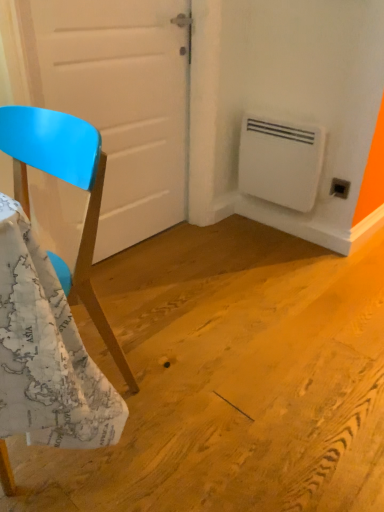
Where is `matte blue chair at left`? The height and width of the screenshot is (512, 384). matte blue chair at left is located at coordinates (69, 183).

The image size is (384, 512). I want to click on black plastic electric outlet at lower right, so click(x=339, y=188).

Image resolution: width=384 pixels, height=512 pixels. Describe the element at coordinates (280, 161) in the screenshot. I see `white plastic air conditioning unit at lower right` at that location.

What are the coordinates of `matte blue chair at left` in the screenshot? It's located at (69, 183).

Could you tell me if white plastic air conditioning unit at lower right is turned towards white matte door at center?

Yes, white plastic air conditioning unit at lower right is facing white matte door at center.

From the image's perspective, is white plastic air conditioning unit at lower right located above white matte door at center?

No, from the image's perspective, white plastic air conditioning unit at lower right is not on top of white matte door at center.

From a real-world perspective, is white plastic air conditioning unit at lower right located beneath white matte door at center?

Yes, from a real-world perspective, white plastic air conditioning unit at lower right is under white matte door at center.

Can you see white plastic air conditioning unit at lower right touching white matte door at center?

white plastic air conditioning unit at lower right is not next to white matte door at center, and they're not touching.

Is point (94, 296) positioned in front of point (335, 183)?

Yes.

From a real-world perspective, is matte blue chair at left positioned under black plastic electric outlet at lower right based on gravity?

Actually, matte blue chair at left is physically above black plastic electric outlet at lower right in the real world.

Could black plastic electric outlet at lower right be considered to be inside matte blue chair at left?

No, black plastic electric outlet at lower right is not a part of matte blue chair at left.

Considering the positions of objects white matte door at center and black plastic electric outlet at lower right in the image provided, who is more to the left, white matte door at center or black plastic electric outlet at lower right?

From the viewer's perspective, white matte door at center appears more on the left side.

Considering the positions of objects white matte door at center and black plastic electric outlet at lower right in the image provided, who is behind, white matte door at center or black plastic electric outlet at lower right?

black plastic electric outlet at lower right is behind.

Based on their sizes in the image, would you say white matte door at center is bigger or smaller than black plastic electric outlet at lower right?

Clearly, white matte door at center is larger in size than black plastic electric outlet at lower right.

From a real-world perspective, is white matte door at center positioned above or below black plastic electric outlet at lower right?

Clearly, from a real-world perspective, white matte door at center is above black plastic electric outlet at lower right.

From the image's perspective, does matte blue chair at left appear lower than white matte door at center?

Yes, from the image's perspective, matte blue chair at left is below white matte door at center.

Consider the image. How many degrees apart are the facing directions of matte blue chair at left and white matte door at center?

89.6 degrees separate the facing orientations of matte blue chair at left and white matte door at center.

Is matte blue chair at left oriented towards white matte door at center?

No, matte blue chair at left is not turned towards white matte door at center.

Considering the sizes of matte blue chair at left and white matte door at center in the image, is matte blue chair at left wider or thinner than white matte door at center?

In the image, matte blue chair at left appears to be wider than white matte door at center.

Could you tell me if white plastic air conditioning unit at lower right is facing black plastic electric outlet at lower right?

No, white plastic air conditioning unit at lower right is not aimed at black plastic electric outlet at lower right.

From the image's perspective, which one is positioned higher, white plastic air conditioning unit at lower right or black plastic electric outlet at lower right?

white plastic air conditioning unit at lower right is shown above in the image.

From a real-world perspective, which object rests below the other?

In real-world perspective, black plastic electric outlet at lower right is lower.

Based on the photo, is white plastic air conditioning unit at lower right spatially inside black plastic electric outlet at lower right, or outside of it?

white plastic air conditioning unit at lower right is spatially situated outside black plastic electric outlet at lower right.

The height and width of the screenshot is (512, 384). Find the location of `electric outlet that appears behind the white matte door at center`. electric outlet that appears behind the white matte door at center is located at coordinates (339, 188).

Is point (346, 193) closer or farther from the camera than point (142, 9)?

Point (346, 193) is positioned farther from the camera compared to point (142, 9).

Is black plastic electric outlet at lower right turned away from white matte door at center?

No, black plastic electric outlet at lower right is not facing the opposite direction of white matte door at center.

Is black plastic electric outlet at lower right located outside white matte door at center?

Yes.

From a real-world perspective, is white plastic air conditioning unit at lower right physically located above or below matte blue chair at left?

Clearly, from a real-world perspective, white plastic air conditioning unit at lower right is below matte blue chair at left.

Can you tell me how much white plastic air conditioning unit at lower right and matte blue chair at left differ in facing direction?

They differ by 0.389 degrees in their facing directions.

From the image's perspective, is white plastic air conditioning unit at lower right on top of matte blue chair at left?

Yes, from the image's perspective, white plastic air conditioning unit at lower right is over matte blue chair at left.

Relative to matte blue chair at left, is white plastic air conditioning unit at lower right in front or behind?

Clearly, white plastic air conditioning unit at lower right is behind matte blue chair at left.

Identify the location of door above the white plastic air conditioning unit at lower right (from the image's perspective). The image size is (384, 512). (123, 103).

Where is `chair in front of the black plastic electric outlet at lower right`? Image resolution: width=384 pixels, height=512 pixels. chair in front of the black plastic electric outlet at lower right is located at coordinates (69, 183).

Looking at the image, which one is located closer to white matte door at center, white plastic air conditioning unit at lower right or black plastic electric outlet at lower right?

white plastic air conditioning unit at lower right lies closer to white matte door at center than the other object.

Looking at the image, which one is located closer to matte blue chair at left, black plastic electric outlet at lower right or white plastic air conditioning unit at lower right?

white plastic air conditioning unit at lower right.

When comparing their distances from white matte door at center, does black plastic electric outlet at lower right or white plastic air conditioning unit at lower right seem closer?

The object closer to white matte door at center is white plastic air conditioning unit at lower right.

Based on their spatial positions, is matte blue chair at left or black plastic electric outlet at lower right further from white matte door at center?

black plastic electric outlet at lower right.

Looking at the image, which one is located further to matte blue chair at left, white matte door at center or white plastic air conditioning unit at lower right?

white plastic air conditioning unit at lower right.

Which object lies nearer to the anchor point black plastic electric outlet at lower right, white matte door at center or matte blue chair at left?

Based on the image, white matte door at center appears to be nearer to black plastic electric outlet at lower right.

When comparing their distances from white plastic air conditioning unit at lower right, does matte blue chair at left or white matte door at center seem further?

Based on the image, matte blue chair at left appears to be further to white plastic air conditioning unit at lower right.

Based on the photo, from the image, which object appears to be nearer to black plastic electric outlet at lower right, white matte door at center or white plastic air conditioning unit at lower right?

Based on the image, white plastic air conditioning unit at lower right appears to be nearer to black plastic electric outlet at lower right.

Locate an element on the screen. The width and height of the screenshot is (384, 512). air conditioning between white matte door at center and black plastic electric outlet at lower right from left to right is located at coordinates (280, 161).

Where is `door between matte blue chair at left and white plastic air conditioning unit at lower right from front to back`? door between matte blue chair at left and white plastic air conditioning unit at lower right from front to back is located at coordinates (123, 103).

Identify the location of air conditioning between matte blue chair at left and black plastic electric outlet at lower right in the front-back direction. This screenshot has height=512, width=384. (280, 161).

Locate an element on the screen. door between matte blue chair at left and black plastic electric outlet at lower right from front to back is located at coordinates (123, 103).